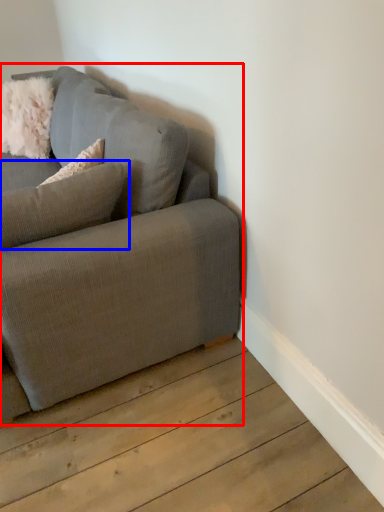
Question: Which point is further to the camera, studio couch (highlighted by a red box) or pillow (highlighted by a blue box)?

Choices:
 (A) studio couch
 (B) pillow

Answer: (B)